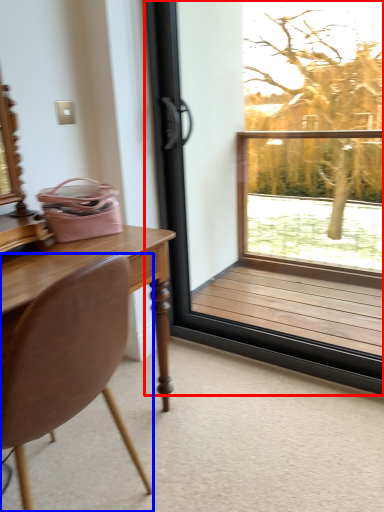
Question: Which point is closer to the camera, window (highlighted by a red box) or chair (highlighted by a blue box)?

Choices:
 (A) window
 (B) chair

Answer: (B)